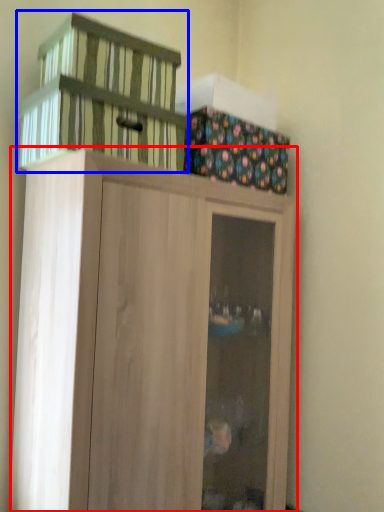
Question: Which point is further to the camera, cupboard (highlighted by a red box) or basket (highlighted by a blue box)?

Choices:
 (A) cupboard
 (B) basket

Answer: (B)